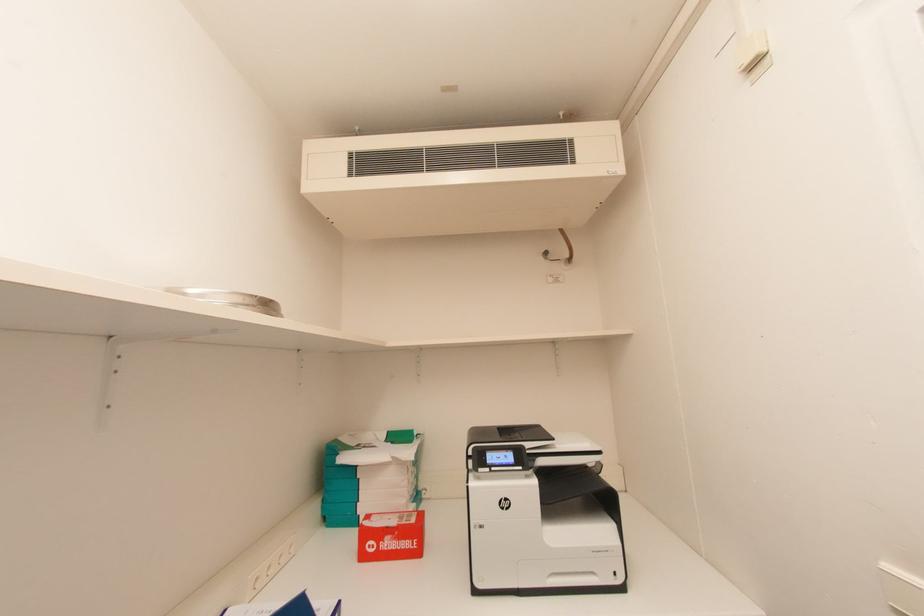
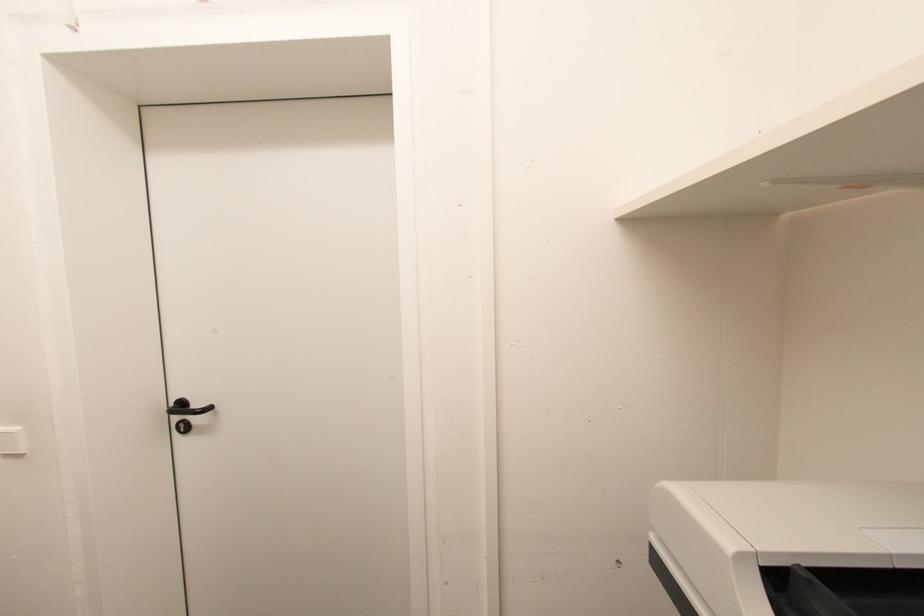
Question: Based on the continuous images, in which direction is the camera rotating? Reply with the corresponding letter.

Choices:
 (A) Left
 (B) Right
 (C) Up
 (D) Down

Answer: (B)